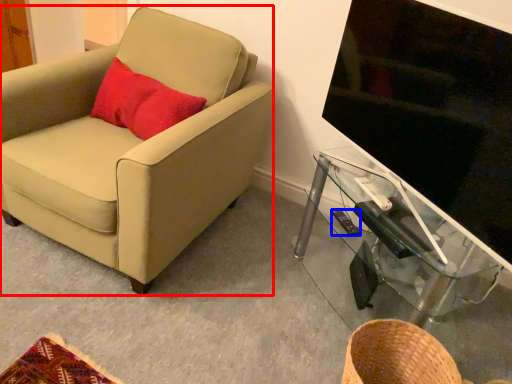
Question: Which object is closer to the camera taking this photo, chair (highlighted by a red box) or remote control (highlighted by a blue box)?

Choices:
 (A) chair
 (B) remote control

Answer: (A)